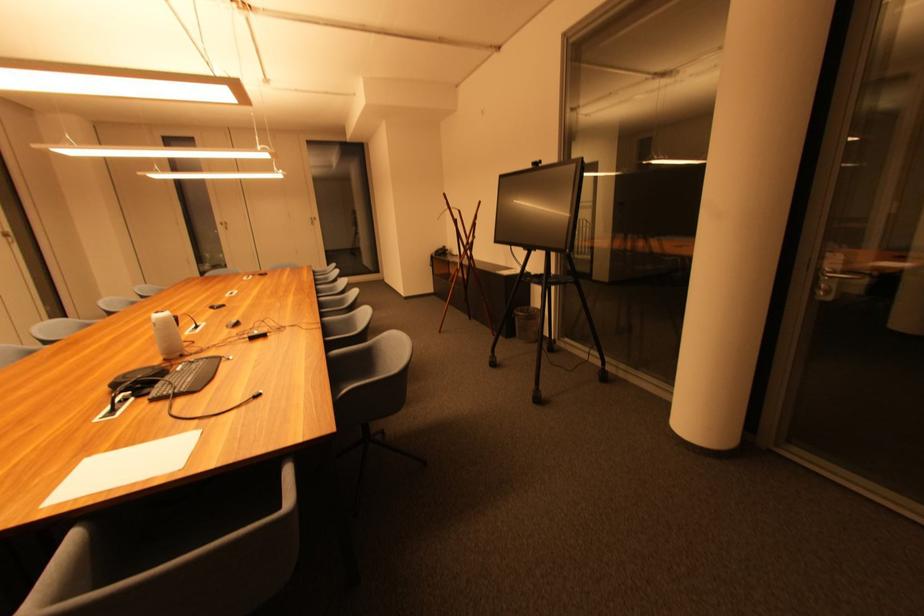
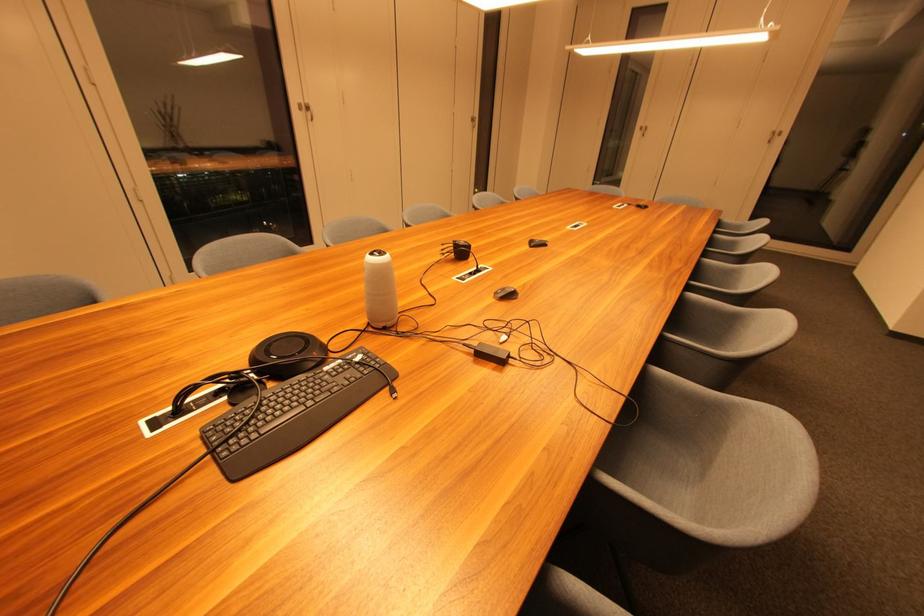
In the second image, find the point that corresponds to the point at 117,413 in the first image.

(185, 414)